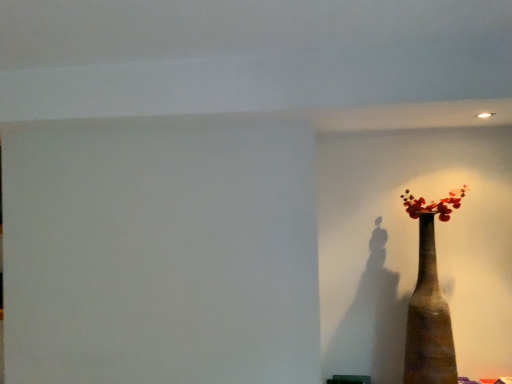
Measure the distance between point (432,223) and camera.

Point (432,223) is 2.44 meters away from camera.

Locate an element on the screen. The width and height of the screenshot is (512, 384). brown textured vase at right is located at coordinates (428, 319).

What do you see at coordinates (428, 319) in the screenshot?
I see `brown textured vase at right` at bounding box center [428, 319].

The height and width of the screenshot is (384, 512). Identify the location of brown textured vase at right. (428, 319).